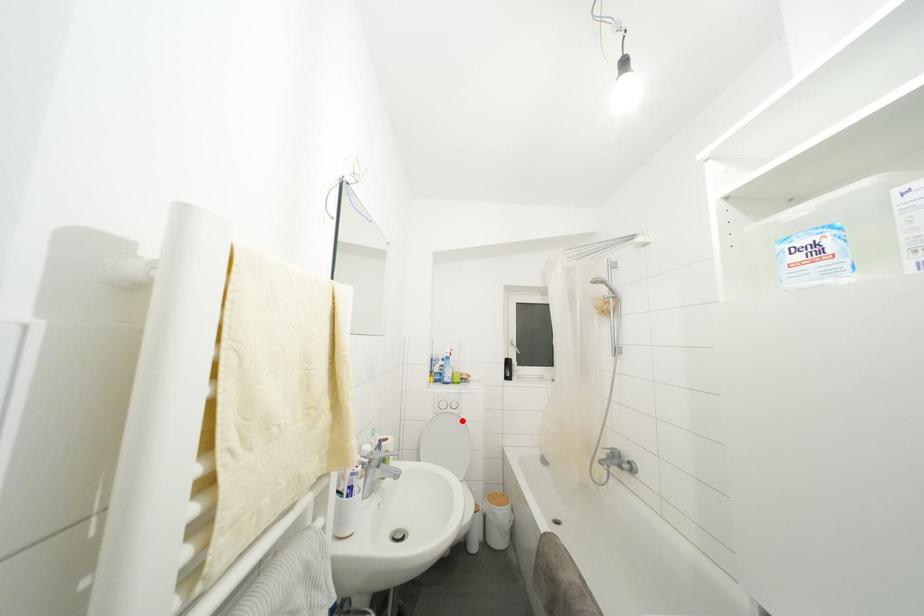
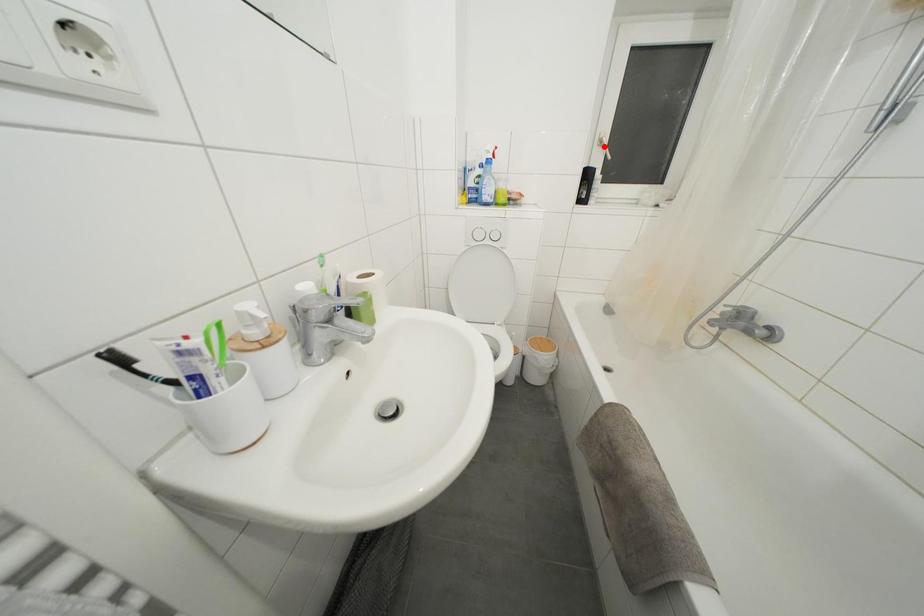
I am providing you with two images of the same scene from different viewpoints. A red point is marked on the first image and another point is marked on the second image. Is the marked point in image1 the same physical position as the marked point in image2?

No